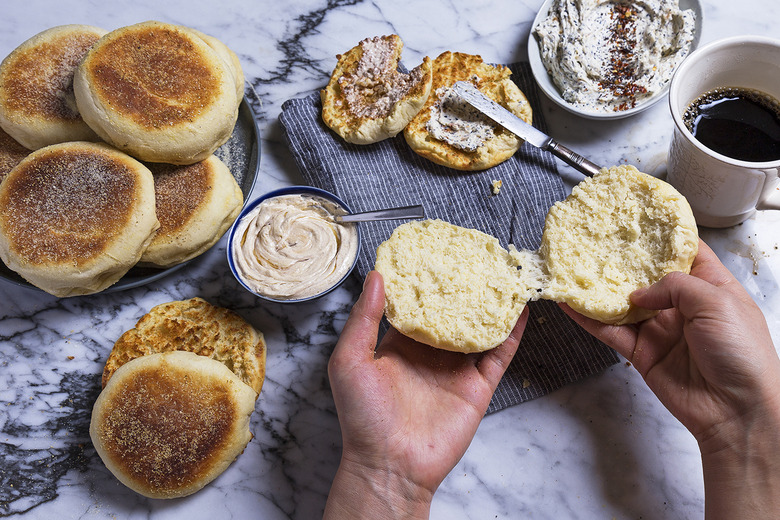
The height and width of the screenshot is (520, 780). I want to click on marble table, so click(x=293, y=378).